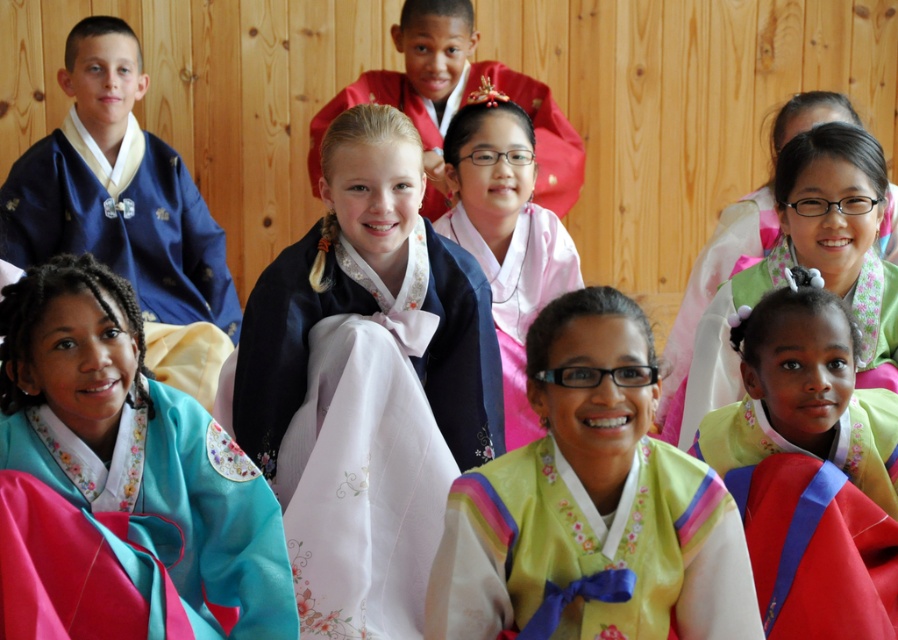
Question: Does satin blue dress at center lie behind matte yellow silk blouse at center?

Choices:
 (A) no
 (B) yes

Answer: (B)

Question: Which point appears closest to the camera in this image?

Choices:
 (A) (224, 556)
 (B) (760, 417)
 (C) (434, 145)

Answer: (A)

Question: Can you confirm if satin blue dress at center is smaller than matte pink kimono at center?

Choices:
 (A) yes
 (B) no

Answer: (B)

Question: Which object is the farthest from the satin blue dress at center?

Choices:
 (A) teal satin blouse at lower left
 (B) matte pink fabric at center
 (C) matte yellow silk blouse at center
 (D) pink satin blouse at center

Answer: (B)

Question: Can you confirm if satin blue dress at center is positioned to the left of matte pink kimono at center?

Choices:
 (A) yes
 (B) no

Answer: (A)

Question: Among these points, which one is farthest from the camera?

Choices:
 (A) (887, 634)
 (B) (432, 147)
 (C) (359, 186)
 (D) (603, 595)

Answer: (B)